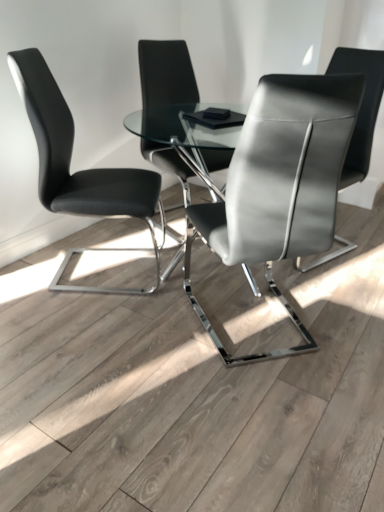
Locate an element on the screen. unoccupied area in front of satin gray leather chair at center, marked as the second chair in a right-to-left arrangement is located at coordinates (x=253, y=401).